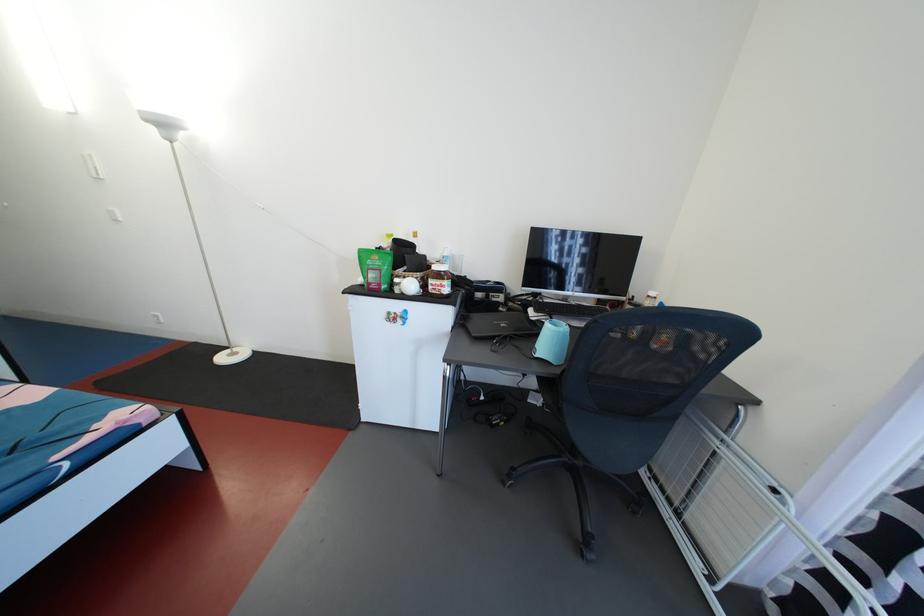
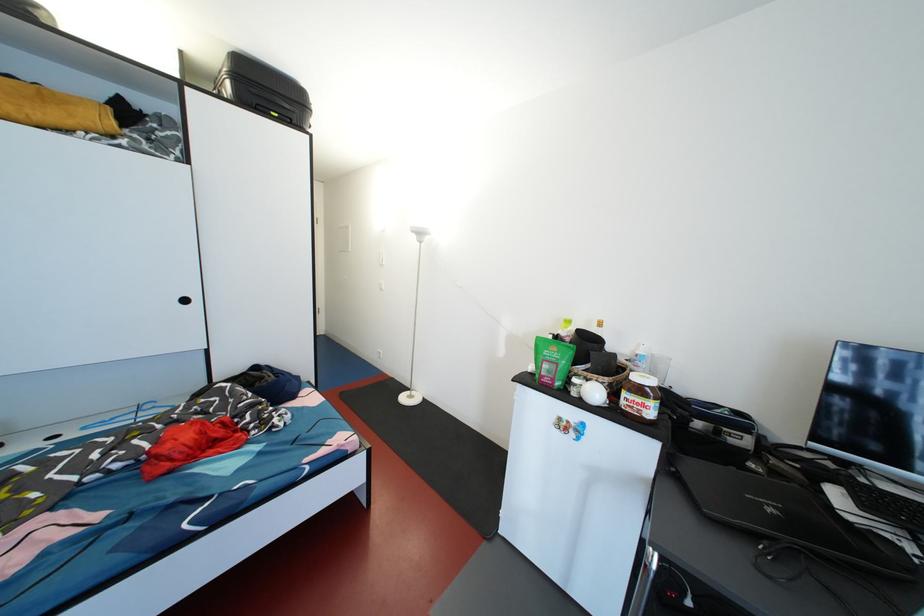
In the second image, find the point that corresponds to [160,134] in the first image.

(420, 241)